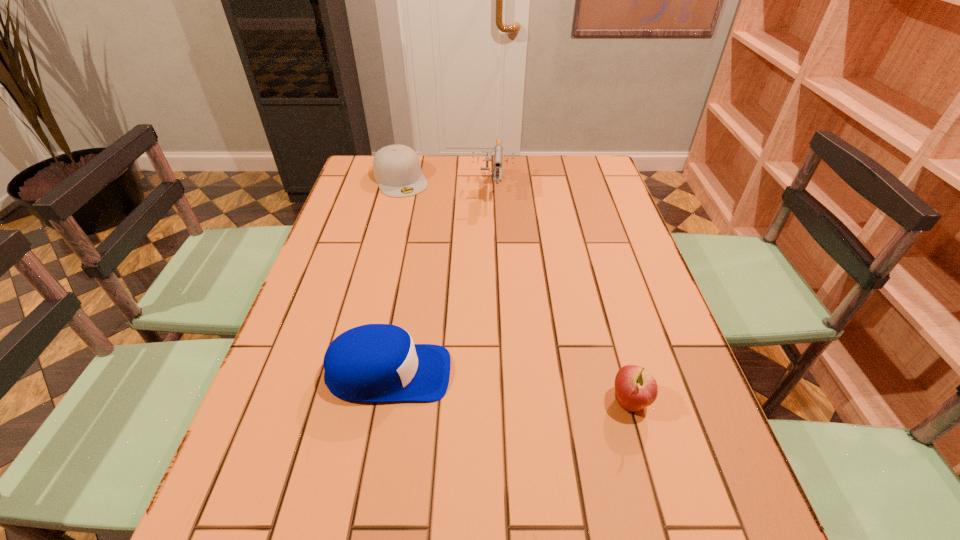
At what (x,y) coordinates should I click in order to perform the action: click on vacant space on the desktop that is between the baseball cap and the rightmost object and is positioned on the front-facing side of the cap. Please return your answer as a coordinate pair (x, y). This screenshot has height=540, width=960. Looking at the image, I should click on (520, 389).

In order to click on free spot on the desktop that is between the baseball cap and the rightmost object and is positioned at the barrel end of the tallest object in this screenshot , I will do `click(481, 384)`.